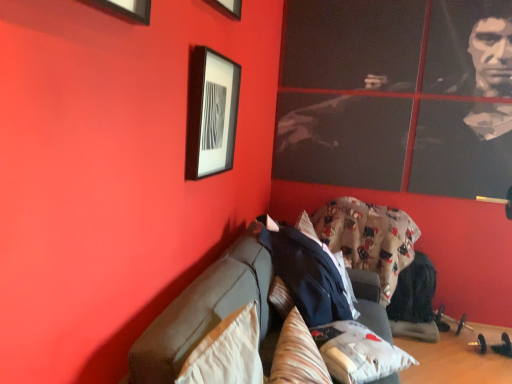
Question: Considering the positions of matte black picture frame at upper left and fluffy white pillow at lower center, positioned as the first pillow in right-to-left order, in the image, is matte black picture frame at upper left bigger or smaller than fluffy white pillow at lower center, positioned as the first pillow in right-to-left order,?

Choices:
 (A) big
 (B) small

Answer: (B)

Question: From the image's perspective, relative to fluffy white pillow at lower center, positioned as the first pillow in right-to-left order, is matte black picture frame at upper left above or below?

Choices:
 (A) below
 (B) above

Answer: (B)

Question: Which object is positioned closest to the matte black picture frame at upper left?

Choices:
 (A) dark gray fabric couch at center
 (B) fluffy cotton blanket at center
 (C) striped fabric pillow at center, acting as the 2th pillow starting from the left
 (D) fluffy white pillow at lower center, positioned as the first pillow in right-to-left order
 (E) beige fabric pillow at lower left, placed as the 1th pillow when sorted from left to right

Answer: (A)

Question: Which is farther from the fluffy cotton blanket at center?

Choices:
 (A) dark gray fabric couch at center
 (B) striped fabric pillow at center, which is the 2th pillow in right-to-left order
 (C) fluffy white pillow at lower center, the 3th pillow from the left
 (D) matte black picture frame at upper left
 (E) beige fabric pillow at lower left, placed as the 1th pillow when sorted from left to right

Answer: (E)